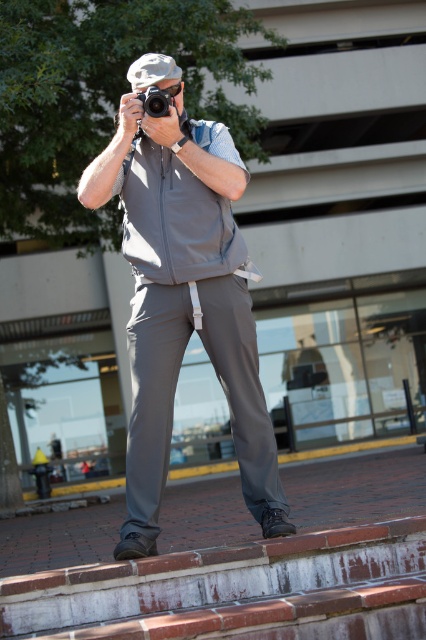
Question: Which point is farther to the camera?

Choices:
 (A) matte black camera at center
 (B) gray matte vest at center

Answer: (A)

Question: Is gray matte vest at center to the right of matte black camera at center from the viewer's perspective?

Choices:
 (A) no
 (B) yes

Answer: (B)

Question: Is gray matte vest at center below matte black camera at center?

Choices:
 (A) no
 (B) yes

Answer: (B)

Question: Is gray matte vest at center bigger than matte black camera at center?

Choices:
 (A) no
 (B) yes

Answer: (B)

Question: Among these objects, which one is nearest to the camera?

Choices:
 (A) matte black camera at center
 (B) gray matte vest at center

Answer: (B)